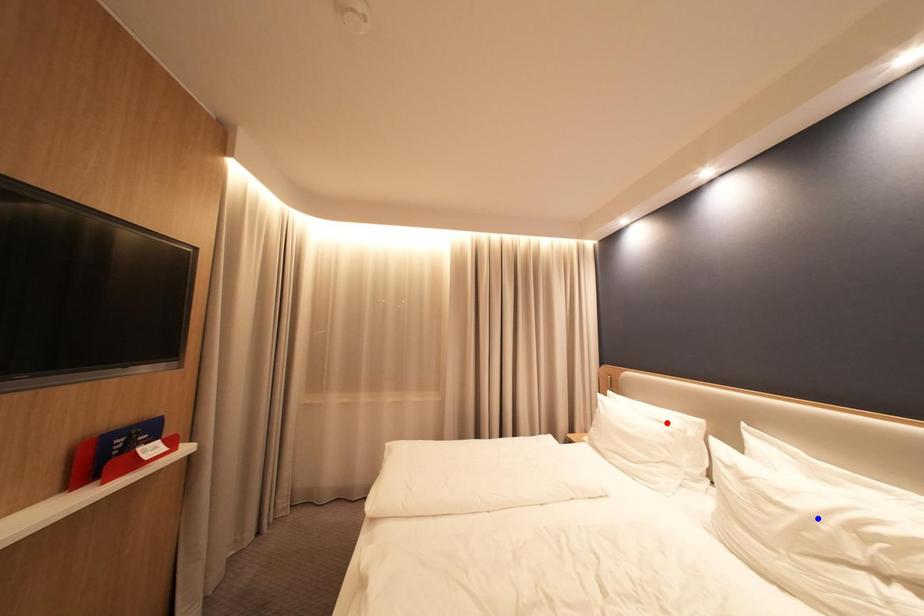
Question: In the image, two points are highlighted. Which point is nearer to the camera? Reply with the corresponding letter.

Choices:
 (A) blue point
 (B) red point

Answer: (A)